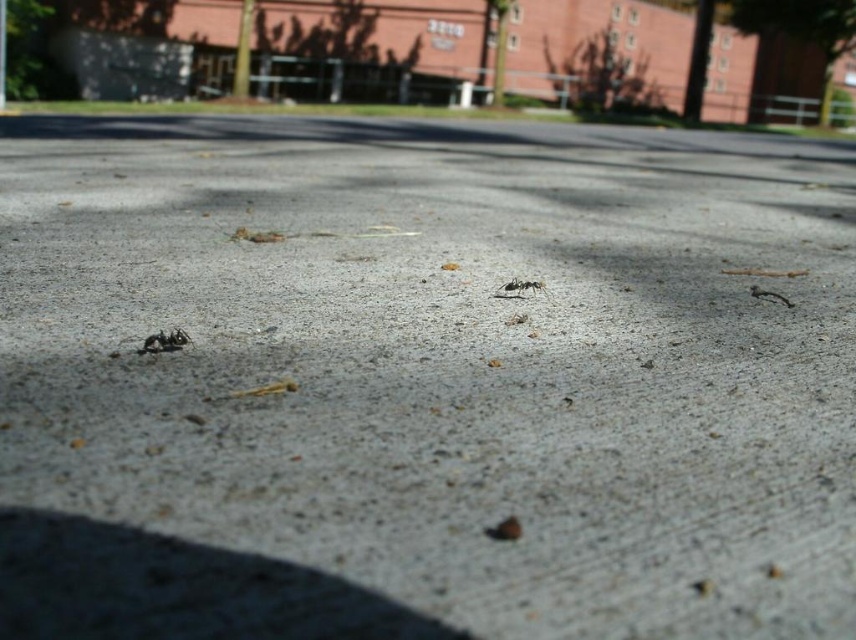
Which is in front, point (508, 284) or point (789, 307)?

Positioned in front is point (508, 284).

Does black matte ant at center lie in front of black matte ant at right?

Yes.

Who is more forward, (512, 285) or (788, 307)?

Point (512, 285) is more forward.

Find the location of `black matte ant at center`. black matte ant at center is located at coordinates (521, 285).

From the picture: Is black matte ant at lower left shorter than black matte ant at center?

Yes.

Is point (180, 332) closer to viewer compared to point (503, 285)?

Yes, point (180, 332) is closer to viewer.

This screenshot has height=640, width=856. I want to click on black matte ant at lower left, so click(165, 340).

Between point (170, 340) and point (779, 298), which one is positioned in front?

Point (170, 340) is in front.

Can you confirm if black matte ant at lower left is positioned above black matte ant at right?

Incorrect, black matte ant at lower left is not positioned above black matte ant at right.

Which is in front, point (176, 348) or point (776, 298)?

Point (176, 348) is in front.

I want to click on black matte ant at lower left, so click(165, 340).